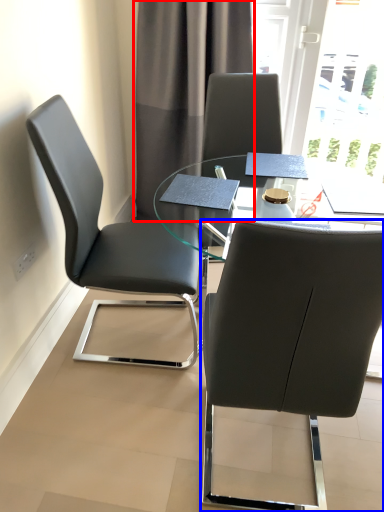
Question: Which point is closer to the camera, curtain (highlighted by a red box) or chair (highlighted by a blue box)?

Choices:
 (A) curtain
 (B) chair

Answer: (B)